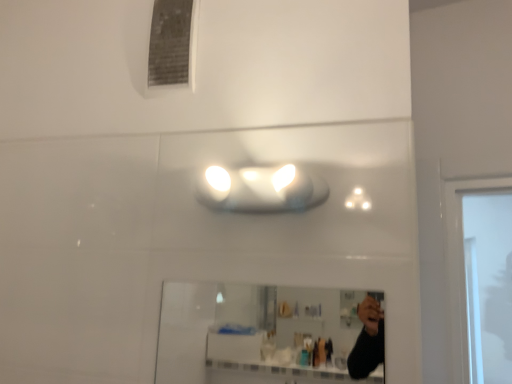
Question: Is white glossy light fixture at center smaller than clear glass mirror at center?

Choices:
 (A) no
 (B) yes

Answer: (A)

Question: Considering the relative sizes of white glossy light fixture at center and clear glass mirror at center in the image provided, is white glossy light fixture at center taller than clear glass mirror at center?

Choices:
 (A) yes
 (B) no

Answer: (B)

Question: Is white glossy light fixture at center behind clear glass mirror at center?

Choices:
 (A) yes
 (B) no

Answer: (A)

Question: Is white glossy light fixture at center facing towards clear glass mirror at center?

Choices:
 (A) yes
 (B) no

Answer: (B)

Question: Is white glossy light fixture at center shorter than clear glass mirror at center?

Choices:
 (A) no
 (B) yes

Answer: (B)

Question: Is white glossy light fixture at center surrounding clear glass mirror at center?

Choices:
 (A) yes
 (B) no

Answer: (B)

Question: Is the position of clear glass mirror at center less distant than that of white glossy light fixture at center?

Choices:
 (A) no
 (B) yes

Answer: (B)

Question: From the image's perspective, would you say clear glass mirror at center is shown under white glossy light fixture at center?

Choices:
 (A) no
 (B) yes

Answer: (B)

Question: Can you confirm if clear glass mirror at center is wider than white glossy light fixture at center?

Choices:
 (A) yes
 (B) no

Answer: (B)

Question: Is clear glass mirror at center aimed at white glossy light fixture at center?

Choices:
 (A) no
 (B) yes

Answer: (A)

Question: Considering the relative positions of clear glass mirror at center and white glossy light fixture at center in the image provided, is clear glass mirror at center to the right of white glossy light fixture at center from the viewer's perspective?

Choices:
 (A) yes
 (B) no

Answer: (A)

Question: Is clear glass mirror at center far from white glossy light fixture at center?

Choices:
 (A) no
 (B) yes

Answer: (B)

Question: Would you say clear glass mirror at center is to the left or to the right of white glossy light fixture at center in the picture?

Choices:
 (A) right
 (B) left

Answer: (A)